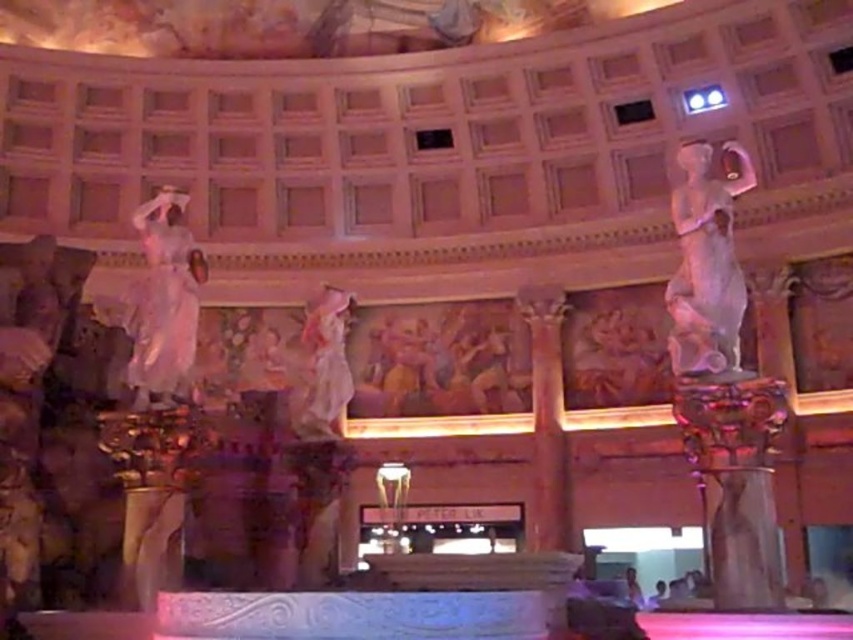
You are an art conservator standing in the Pantheon replica and want to examine the white marble statue at left. If your reach can extend up to 2 meters, can you touch the statue without moving closer?

The white marble statue at left is 29.58 meters away from the viewer. Since your reach is only 2 meters, you cannot touch the statue without moving closer.

You are an art curator planning to move the white marble statue at right and the white marble statue at center to a new exhibition space. The new space has a height restriction of 2.5 meters. Given their sizes, which statue would you prioritize moving first to ensure it fits within the height limit?

The white marble statue at center should be prioritized since it is smaller in size than the white marble statue at right, ensuring it will fit under the 2.5 meters height restriction before moving the larger one.

You are an art curator planning to display the white marble statue at right and the white marble statue at center in a new exhibition. Given their sizes, which statue would require a taller pedestal to maintain visual balance with the other?

The white marble statue at right is much taller than the white marble statue at center, so it would require a taller pedestal to maintain visual balance with the other.